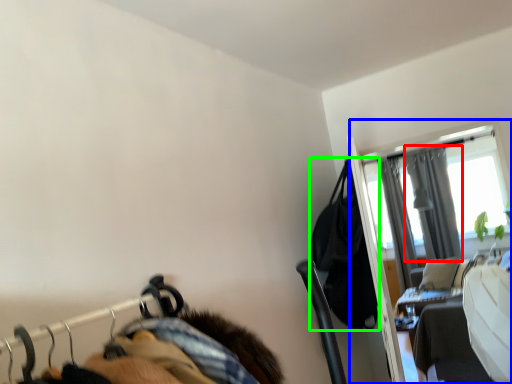
Question: Which object is the closest to the curtain (highlighted by a red box)? Choose among these: screen door (highlighted by a blue box) or clothing (highlighted by a green box).

Choices:
 (A) screen door
 (B) clothing

Answer: (A)